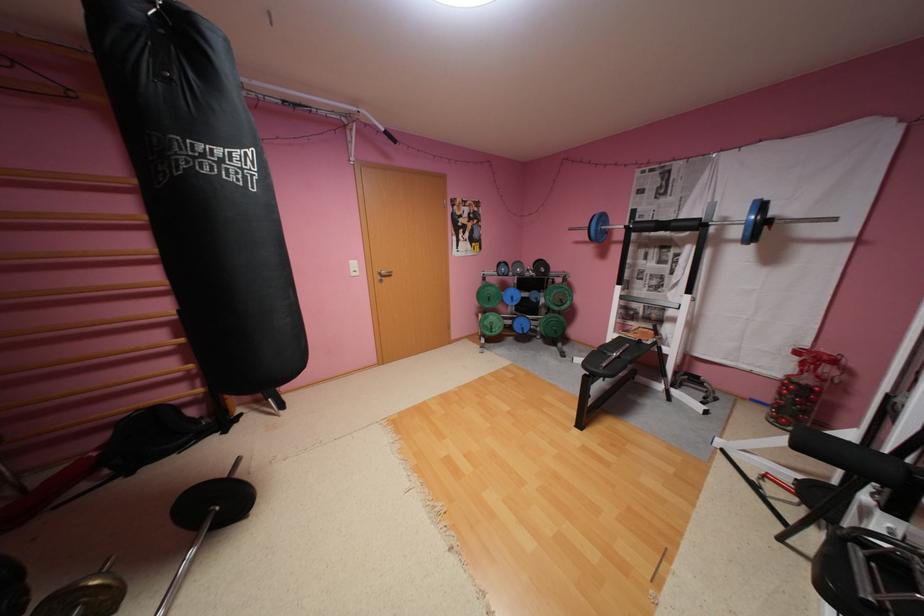
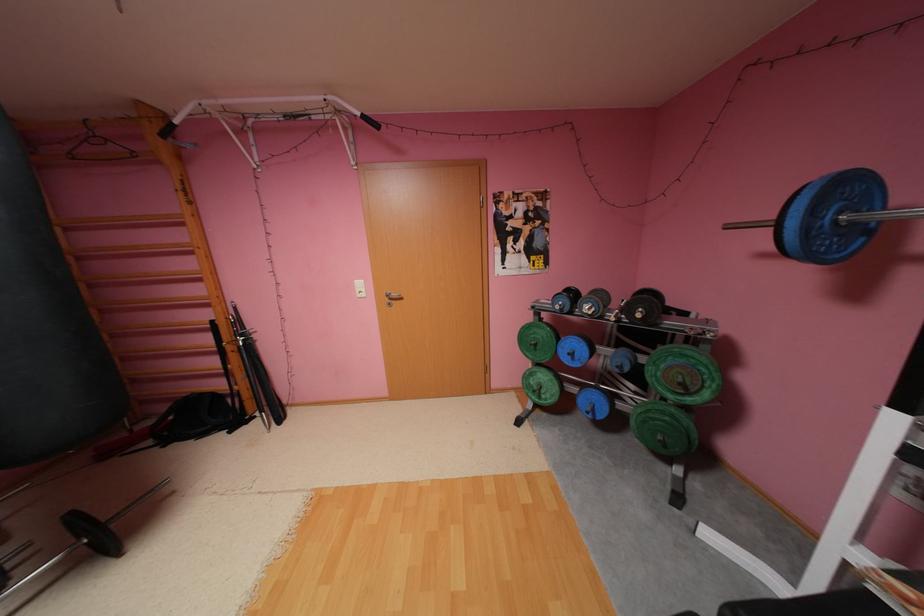
Where in the second image is the point corresponding to the point at 528,275 from the first image?

(600, 315)